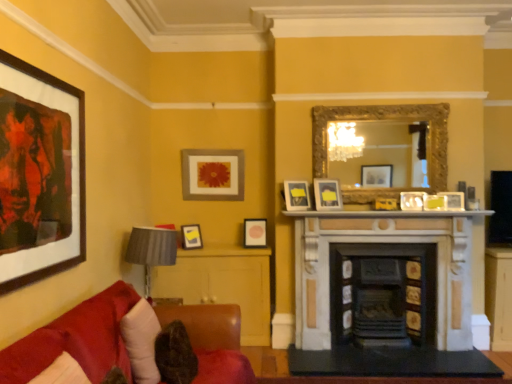
Find the location of a particular element. The height and width of the screenshot is (384, 512). free point above gold ornate mirror at upper center (from a real-world perspective) is located at coordinates (381, 99).